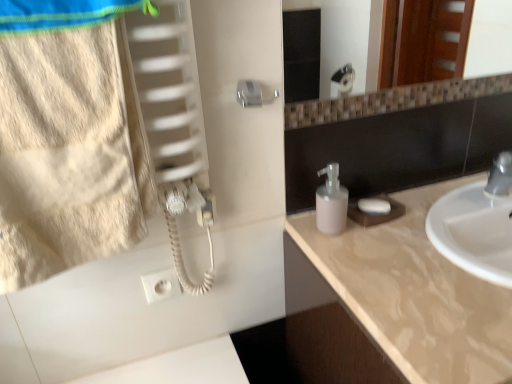
Identify the location of beige cotton towel at left. (69, 152).

What is the approximate height of beige marble countertop at right?

beige marble countertop at right is 1.68 inches tall.

Identify the location of beige cotton towel at left. Image resolution: width=512 pixels, height=384 pixels. (69, 152).

From a real-world perspective, which is physically below, beige marble countertop at right or beige cotton towel at left?

beige marble countertop at right is physically lower.

Is beige marble countertop at right at the right side of beige cotton towel at left?

Indeed, beige marble countertop at right is positioned on the right side of beige cotton towel at left.

Can you confirm if beige marble countertop at right is taller than beige cotton towel at left?

No, beige marble countertop at right is not taller than beige cotton towel at left.

From a real-world perspective, is pink matte soap dispenser at center located beneath beige cotton towel at left?

Correct, in the physical world, pink matte soap dispenser at center is lower than beige cotton towel at left.

Which is farther, (326, 198) or (88, 84)?

The point (326, 198) is more distant.

Between pink matte soap dispenser at center and beige cotton towel at left, which one is positioned in front?

beige cotton towel at left is closer to the camera.

Between pink matte soap dispenser at center and beige cotton towel at left, which one has more height?

With more height is beige cotton towel at left.

From the image's perspective, would you say pink matte soap dispenser at center is shown under beige marble countertop at right?

No.

Considering the positions of objects pink matte soap dispenser at center and beige marble countertop at right in the image provided, who is behind, pink matte soap dispenser at center or beige marble countertop at right?

pink matte soap dispenser at center is more distant.

Does pink matte soap dispenser at center turn towards beige marble countertop at right?

No, pink matte soap dispenser at center is not oriented towards beige marble countertop at right.

What's the angular difference between pink matte soap dispenser at center and beige marble countertop at right's facing directions?

1.4 degrees.

Who is more distant, beige marble countertop at right or pink matte soap dispenser at center?

pink matte soap dispenser at center is behind.

From the image's perspective, which one is positioned higher, beige marble countertop at right or pink matte soap dispenser at center?

pink matte soap dispenser at center is shown above in the image.

From a real-world perspective, is beige marble countertop at right located beneath pink matte soap dispenser at center?

Correct, in the physical world, beige marble countertop at right is lower than pink matte soap dispenser at center.

Could you tell me if beige marble countertop at right is turned towards pink matte soap dispenser at center?

No, beige marble countertop at right is not aimed at pink matte soap dispenser at center.

Is point (369, 202) in front of point (109, 172)?

No, it is not.

Does white matte soap at right have a greater width compared to beige cotton towel at left?

In fact, white matte soap at right might be narrower than beige cotton towel at left.

From the image's perspective, which one is positioned higher, white matte soap at right or beige cotton towel at left?

beige cotton towel at left.

Looking at this image, considering the relative sizes of white matte soap at right and beige cotton towel at left in the image provided, is white matte soap at right taller than beige cotton towel at left?

Incorrect, the height of white matte soap at right is not larger of that of beige cotton towel at left.

Is white matte soap at right positioned with its back to pink matte soap dispenser at center?

No, white matte soap at right is not facing the opposite direction of pink matte soap dispenser at center.

Based on the photo, from a real-world perspective, does white matte soap at right stand above pink matte soap dispenser at center?

No, from a real-world perspective, white matte soap at right is not above pink matte soap dispenser at center.

The width and height of the screenshot is (512, 384). In order to click on soap that is below the pink matte soap dispenser at center (from the image's perspective) in this screenshot , I will do `click(374, 206)`.

How much distance is there between white matte soap at right and pink matte soap dispenser at center?

white matte soap at right and pink matte soap dispenser at center are 4.85 inches apart.

Is white matte soap at right facing away from beige marble countertop at right?

white matte soap at right is not turned away from beige marble countertop at right.

Does white matte soap at right appear on the left side of beige marble countertop at right?

Correct, you'll find white matte soap at right to the left of beige marble countertop at right.

Is point (386, 200) positioned after point (483, 309)?

Yes, it is.

Does white matte soap at right contain beige marble countertop at right?

No, beige marble countertop at right is located outside of white matte soap at right.

At what (x,y) coordinates should I click in order to perform the action: click on countertop beneath the beige cotton towel at left (from a real-world perspective). Please return your answer as a coordinate pair (x, y). The width and height of the screenshot is (512, 384). Looking at the image, I should click on (415, 294).

You are a GUI agent. You are given a task and a screenshot of the screen. Output one action in this format:
    pyautogui.click(x=<x>, y=<y>)
    Task: Click on the beach towel above the pink matte soap dispenser at center (from the image's perspective)
    
    Given the screenshot: What is the action you would take?
    pyautogui.click(x=69, y=152)

Looking at this image, when comparing their distances from beige cotton towel at left, does white matte soap at right or beige marble countertop at right seem further?

Among the two, white matte soap at right is located further to beige cotton towel at left.

Which object lies nearer to the anchor point beige marble countertop at right, white matte soap at right or beige cotton towel at left?

white matte soap at right lies closer to beige marble countertop at right than the other object.

Estimate the real-world distances between objects in this image. Which object is further from pink matte soap dispenser at center, white matte soap at right or beige marble countertop at right?

beige marble countertop at right is positioned further to the anchor pink matte soap dispenser at center.

Looking at the image, which one is located closer to white matte soap at right, pink matte soap dispenser at center or beige marble countertop at right?

Based on the image, pink matte soap dispenser at center appears to be nearer to white matte soap at right.

Which object lies nearer to the anchor point pink matte soap dispenser at center, beige cotton towel at left or beige marble countertop at right?

beige marble countertop at right is closer to pink matte soap dispenser at center.

Looking at the image, which one is located further to pink matte soap dispenser at center, beige marble countertop at right or beige cotton towel at left?

beige cotton towel at left lies further to pink matte soap dispenser at center than the other object.

Based on their spatial positions, is beige marble countertop at right or beige cotton towel at left further from white matte soap at right?

Among the two, beige cotton towel at left is located further to white matte soap at right.

Estimate the real-world distances between objects in this image. Which object is closer to beige cotton towel at left, white matte soap at right or pink matte soap dispenser at center?

pink matte soap dispenser at center is positioned closer to the anchor beige cotton towel at left.

This screenshot has width=512, height=384. Find the location of `soap dispenser between beige cotton towel at left and white matte soap at right in the horizontal direction`. soap dispenser between beige cotton towel at left and white matte soap at right in the horizontal direction is located at coordinates pos(331,202).

The width and height of the screenshot is (512, 384). I want to click on soap dispenser located between beige marble countertop at right and white matte soap at right in the depth direction, so click(331, 202).

This screenshot has width=512, height=384. Find the location of `soap located between beige cotton towel at left and beige marble countertop at right in the left-right direction`. soap located between beige cotton towel at left and beige marble countertop at right in the left-right direction is located at coordinates click(x=374, y=206).

At what (x,y) coordinates should I click in order to perform the action: click on soap dispenser located between beige cotton towel at left and beige marble countertop at right in the left-right direction. Please return your answer as a coordinate pair (x, y). The height and width of the screenshot is (384, 512). Looking at the image, I should click on (331, 202).